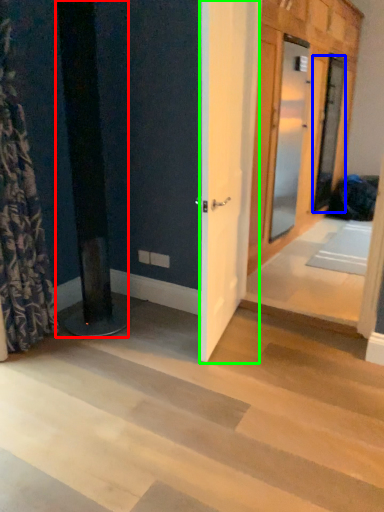
Question: Which is farther away from pillar (highlighted by a red box)? door (highlighted by a blue box) or barn door (highlighted by a green box)?

Choices:
 (A) door
 (B) barn door

Answer: (A)